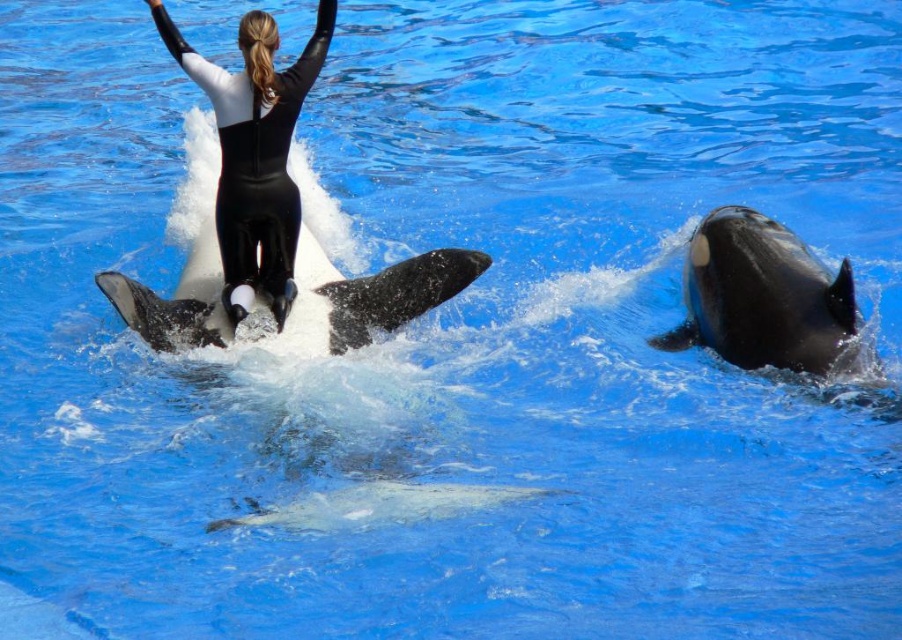
Measure the distance between black smooth whale at right and black smooth dolphin at center.

black smooth whale at right and black smooth dolphin at center are 3.59 meters apart.

Is black smooth whale at right positioned in front of black smooth dolphin at center?

Yes, it is.

You are a GUI agent. You are given a task and a screenshot of the screen. Output one action in this format:
    pyautogui.click(x=<x>, y=<y>)
    Task: Click on the black smooth whale at right
    
    Given the screenshot: What is the action you would take?
    pyautogui.click(x=774, y=308)

Who is shorter, black matte wetsuit at center or black smooth dolphin at center?

black matte wetsuit at center is shorter.

Is point (241, 42) behind point (405, 259)?

No, it is not.

Find the location of a particular element. The height and width of the screenshot is (640, 902). black matte wetsuit at center is located at coordinates (255, 154).

Which of these two, black smooth whale at right or black matte wetsuit at center, stands shorter?

Standing shorter between the two is black matte wetsuit at center.

Which is above, black smooth whale at right or black matte wetsuit at center?

Positioned higher is black matte wetsuit at center.

Is point (707, 244) closer to viewer compared to point (265, 237)?

Yes, point (707, 244) is closer to viewer.

What are the coordinates of `black smooth whale at right` in the screenshot? It's located at (774, 308).